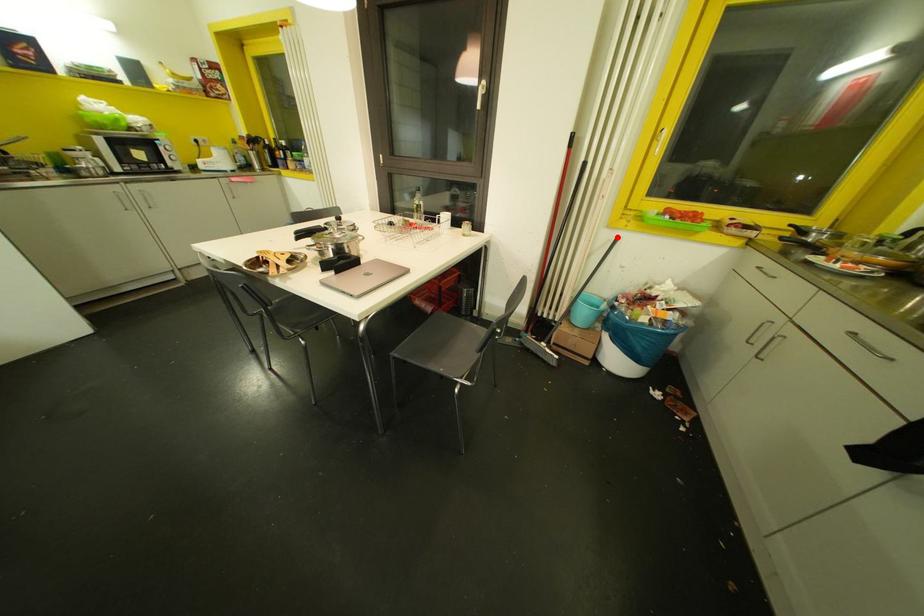
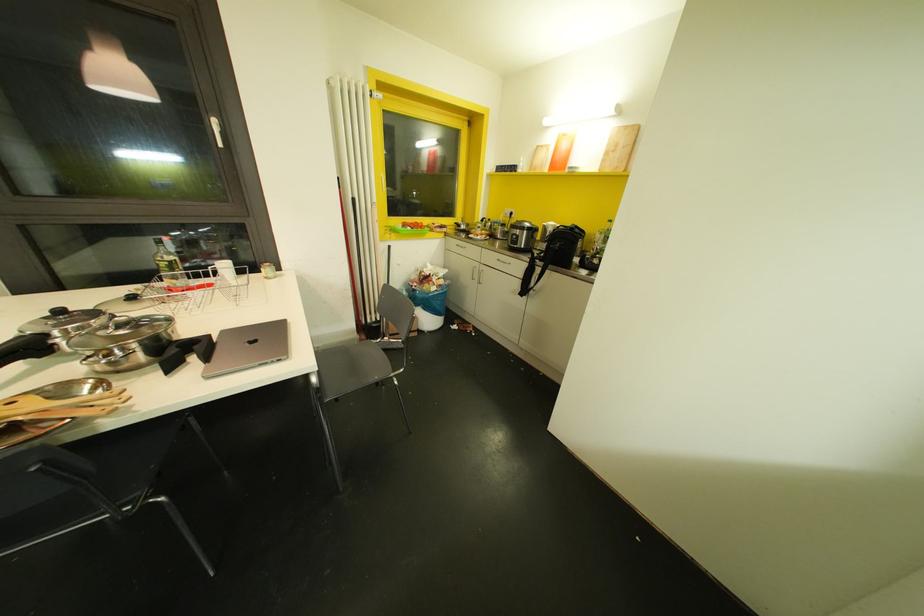
Find the pixel in the second image that matches the highlighted location in the first image.

(388, 246)